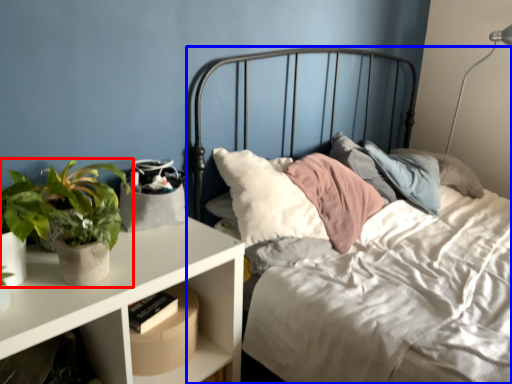
Question: Which object appears farthest to the camera in this image, houseplant (highlighted by a red box) or bed (highlighted by a blue box)?

Choices:
 (A) houseplant
 (B) bed

Answer: (A)